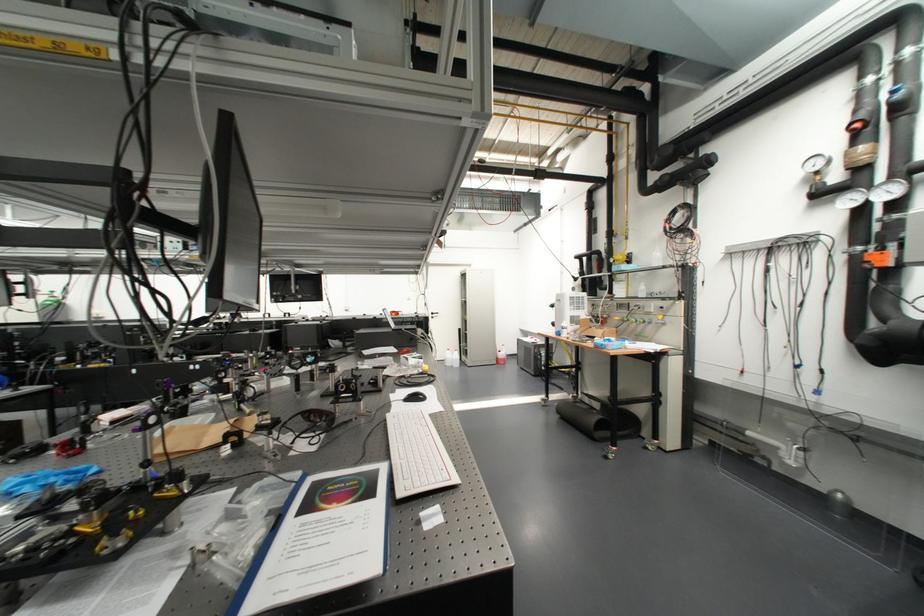
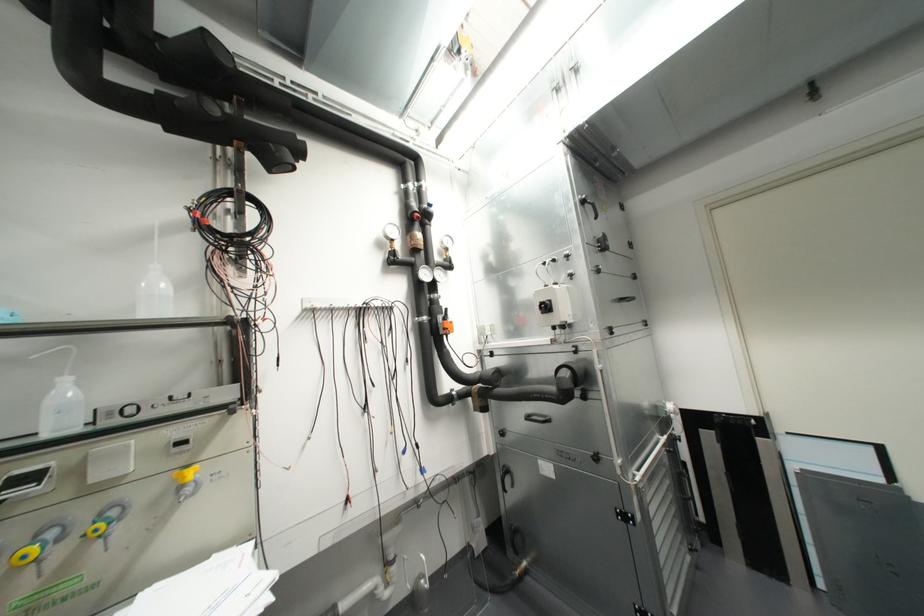
Question: I am providing you with two images of the same scene from different viewpoints. After the viewpoint changes to image2, which objects are now occluded?

Choices:
 (A) yellow valve handle
 (B) yellow equipment knob
 (C) plastic wash bottle
 (D) orange pumpkin object

Answer: (B)